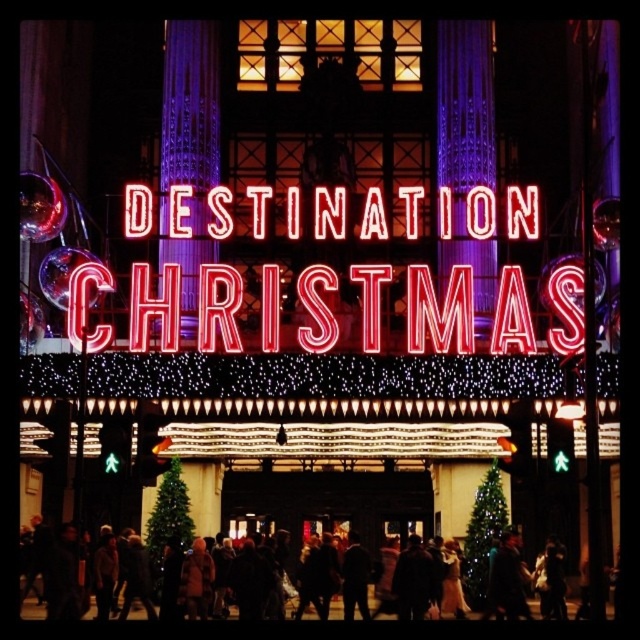
You are a photographer setting up a camera to capture the neon sign at center and the green matte christmas tree at lower center. Which object should you focus on first if you want to ensure both are in frame without moving the camera?

The neon sign at center might be wider than the green matte christmas tree at lower center, so you should focus on the neon sign at center first to ensure it fits within the frame.

You are a photographer standing in front of the Destination Christmas building. You want to take a photo of the neon sign at center and the dark brown leather jacket at center. Which object is positioned higher in the image?

The neon sign at center is located above the dark brown leather jacket at center, so it is positioned higher in the image.